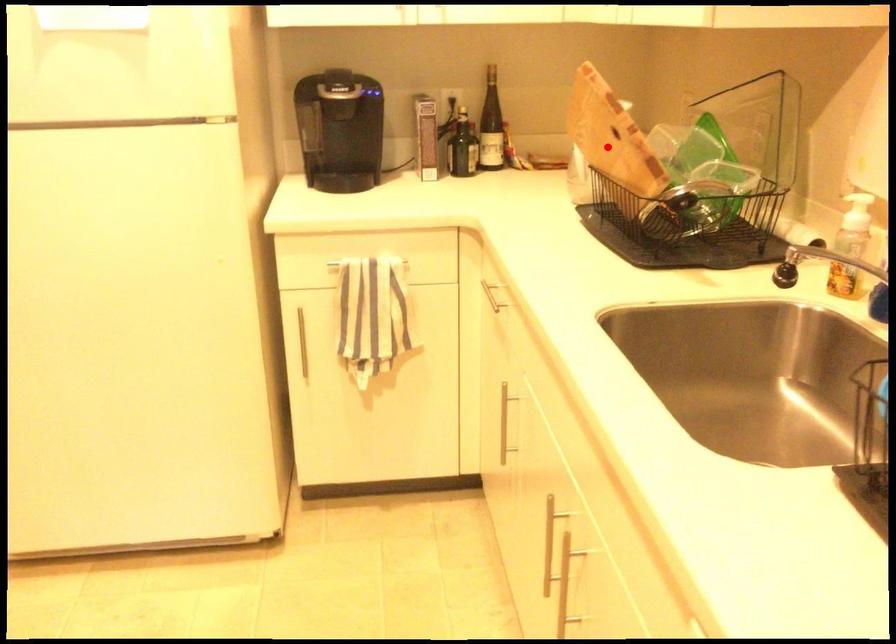
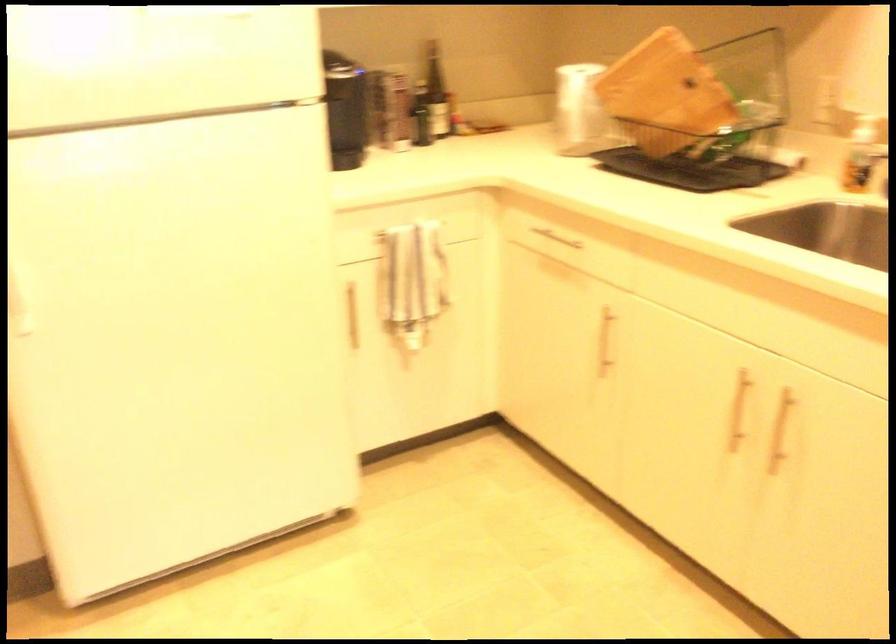
Question: I am providing you with two images of the same scene from different viewpoints. A red point is shown in image1. For the corresponding object point in image2, is it positioned nearer or farther from the camera?

Choices:
 (A) Nearer
 (B) Farther

Answer: (B)